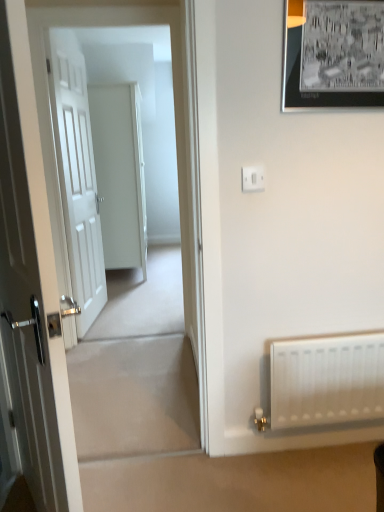
Question: From their relative heights in the image, would you say white plastic switch at upper center is taller or shorter than white matte door at left, acting as the 3th door starting from the back?

Choices:
 (A) short
 (B) tall

Answer: (A)

Question: Is white plastic switch at upper center inside the boundaries of white matte door at left, acting as the 3th door starting from the back, or outside?

Choices:
 (A) outside
 (B) inside

Answer: (A)

Question: Estimate the real-world distances between objects in this image. Which object is farther from the white matte door at left, acting as the 3th door starting from the back?

Choices:
 (A) white matte radiator at lower right
 (B) white wooden door at left, the 2th door when ordered from front to back
 (C) white plastic switch at upper center
 (D) white glossy door at center, which appears as the 3th door when viewed from the front
 (E) black matte picture frame at upper right

Answer: (D)

Question: Estimate the real-world distances between objects in this image. Which object is closer to the white matte door at left, which appears as the first door when viewed from the front?

Choices:
 (A) white wooden door at left, arranged as the second door when viewed from the back
 (B) white matte radiator at lower right
 (C) white plastic switch at upper center
 (D) black matte picture frame at upper right
 (E) white glossy door at center, which appears as the 3th door when viewed from the front

Answer: (C)